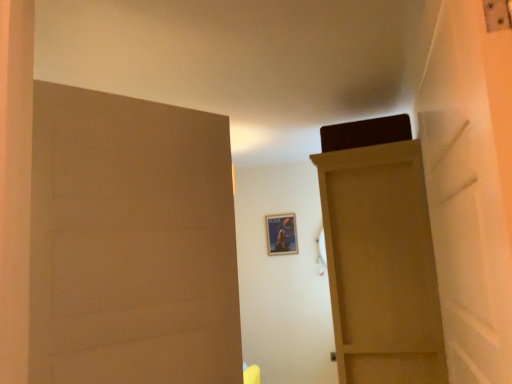
Question: From the image's perspective, is matte wood door at left, the first door positioned from the front, beneath matte wood door at upper right, placed as the 1th door when sorted from right to left?

Choices:
 (A) no
 (B) yes

Answer: (A)

Question: Could matte wood door at upper right, arranged as the 2th door when viewed from the left, be considered to be inside matte wood door at left, the first door positioned from the front?

Choices:
 (A) no
 (B) yes

Answer: (A)

Question: Would you say matte wood door at left, which appears as the 1th door when viewed from the left, is a long distance from matte wood door at upper right, arranged as the 2th door when viewed from the front?

Choices:
 (A) no
 (B) yes

Answer: (A)

Question: Can you confirm if matte wood door at left, arranged as the 2th door when viewed from the back, is bigger than matte wood door at upper right, acting as the first door starting from the back?

Choices:
 (A) no
 (B) yes

Answer: (A)

Question: Can you confirm if matte wood door at left, which appears as the 1th door when viewed from the left, is positioned to the right of matte wood door at upper right, arranged as the 2th door when viewed from the front?

Choices:
 (A) no
 (B) yes

Answer: (A)

Question: From a real-world perspective, does matte wood door at left, the second door when ordered from right to left, stand above matte wood door at upper right, placed as the 1th door when sorted from right to left?

Choices:
 (A) no
 (B) yes

Answer: (B)

Question: Is matte wood door at upper right, arranged as the 2th door when viewed from the left, facing away from metallic poster at center?

Choices:
 (A) yes
 (B) no

Answer: (B)

Question: Does matte wood door at upper right, acting as the first door starting from the back, come behind metallic poster at center?

Choices:
 (A) no
 (B) yes

Answer: (A)

Question: From the image's perspective, is matte wood door at upper right, placed as the 1th door when sorted from right to left, below metallic poster at center?

Choices:
 (A) yes
 (B) no

Answer: (A)

Question: Is matte wood door at upper right, arranged as the 2th door when viewed from the left, not close to metallic poster at center?

Choices:
 (A) no
 (B) yes

Answer: (B)

Question: Is matte wood door at upper right, arranged as the 2th door when viewed from the front, completely or partially outside of metallic poster at center?

Choices:
 (A) yes
 (B) no

Answer: (A)

Question: Can you see matte wood door at upper right, arranged as the 2th door when viewed from the front, touching metallic poster at center?

Choices:
 (A) no
 (B) yes

Answer: (A)

Question: Considering the relative positions of metallic poster at center and matte wood door at left, arranged as the 2th door when viewed from the back, in the image provided, is metallic poster at center behind matte wood door at left, arranged as the 2th door when viewed from the back,?

Choices:
 (A) yes
 (B) no

Answer: (A)